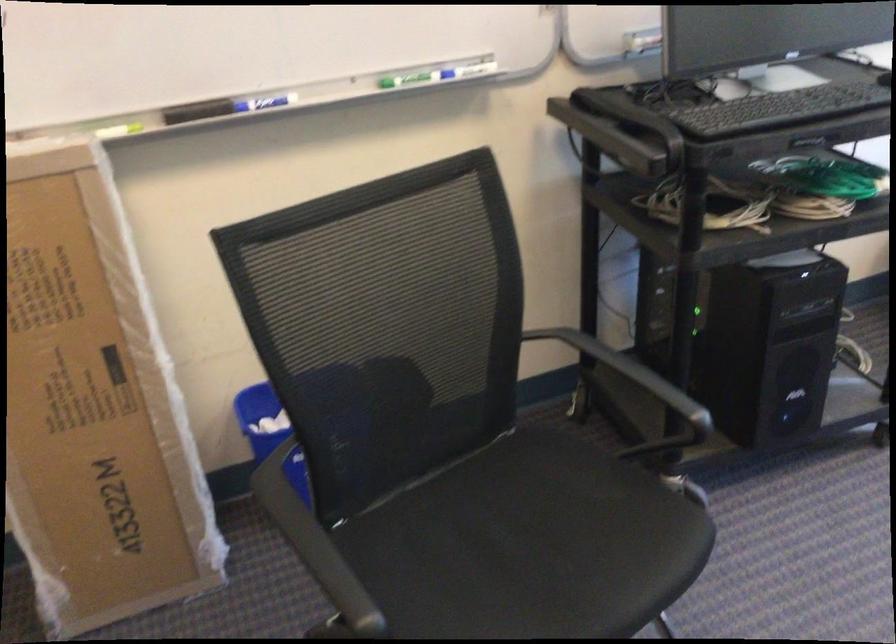
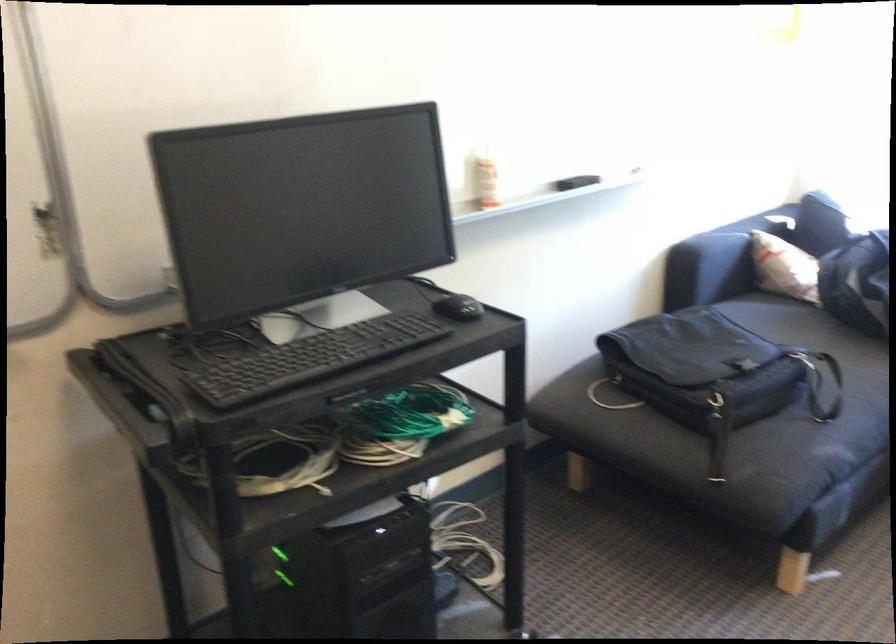
Question: The first image is from the beginning of the video and the second image is from the end. How did the camera likely rotate when shooting the video?

Choices:
 (A) Left
 (B) Right
 (C) Up
 (D) Down

Answer: (B)